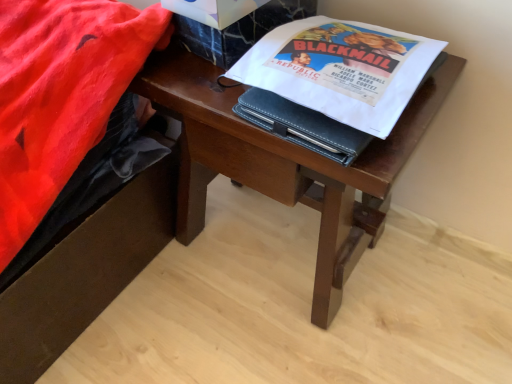
Question: From the image's perspective, is wooden desk at center on white paper at upper center?

Choices:
 (A) yes
 (B) no

Answer: (B)

Question: Is wooden desk at center behind white paper at upper center?

Choices:
 (A) no
 (B) yes

Answer: (B)

Question: Can you confirm if wooden desk at center is wider than white paper at upper center?

Choices:
 (A) yes
 (B) no

Answer: (A)

Question: Does wooden desk at center come in front of white paper at upper center?

Choices:
 (A) yes
 (B) no

Answer: (B)

Question: Is wooden desk at center at the left side of white paper at upper center?

Choices:
 (A) yes
 (B) no

Answer: (A)

Question: Is wooden desk at center positioned with its back to white paper at upper center?

Choices:
 (A) no
 (B) yes

Answer: (A)

Question: Does white paper at upper center appear on the left side of wooden desk at center?

Choices:
 (A) no
 (B) yes

Answer: (A)

Question: Does white paper at upper center appear on the right side of wooden desk at center?

Choices:
 (A) no
 (B) yes

Answer: (B)

Question: Can you confirm if white paper at upper center is bigger than wooden desk at center?

Choices:
 (A) yes
 (B) no

Answer: (B)

Question: Considering the relative sizes of white paper at upper center and wooden desk at center in the image provided, is white paper at upper center wider than wooden desk at center?

Choices:
 (A) no
 (B) yes

Answer: (A)

Question: Is white paper at upper center outside wooden desk at center?

Choices:
 (A) no
 (B) yes

Answer: (B)

Question: Does white paper at upper center have a lesser height compared to wooden desk at center?

Choices:
 (A) no
 (B) yes

Answer: (B)

Question: Visually, is white paper at upper center positioned to the left or to the right of wooden desk at center?

Choices:
 (A) left
 (B) right

Answer: (B)